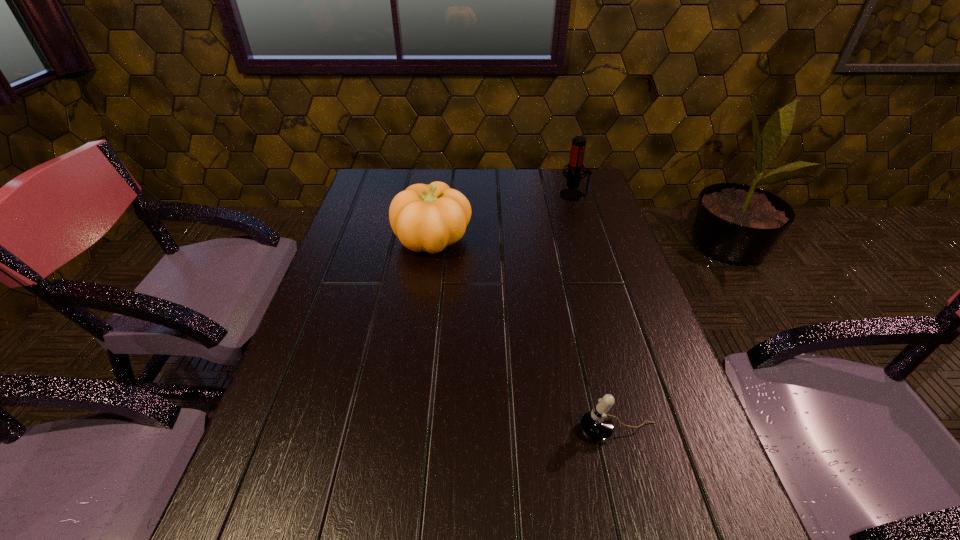
Locate an element on the screen. the farther microphone is located at coordinates (575, 166).

Where is `the farthest object`? The image size is (960, 540). the farthest object is located at coordinates (575, 166).

In order to click on the leftmost object in this screenshot , I will do `click(429, 218)`.

This screenshot has width=960, height=540. Find the location of `the second farthest object`. the second farthest object is located at coordinates (429, 218).

Identify the location of the shortest object. (596, 425).

Where is `the shorter microphone`? This screenshot has width=960, height=540. the shorter microphone is located at coordinates (596, 425).

The height and width of the screenshot is (540, 960). In order to click on vacant area situated on the left of the taller microphone in this screenshot , I will do `click(489, 195)`.

Find the location of a particular element. Image resolution: width=960 pixels, height=540 pixels. vacant space located 0.160m on the right of the pumpkin is located at coordinates (526, 239).

Image resolution: width=960 pixels, height=540 pixels. Find the location of `vacant region located on the front of the nearer microphone`. vacant region located on the front of the nearer microphone is located at coordinates (640, 516).

Image resolution: width=960 pixels, height=540 pixels. I want to click on object located at the far edge, so click(x=575, y=166).